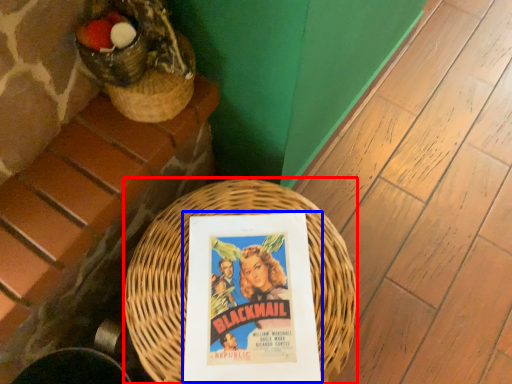
Question: Which point is further to the camera, basket (highlighted by a red box) or paperback book (highlighted by a blue box)?

Choices:
 (A) basket
 (B) paperback book

Answer: (B)